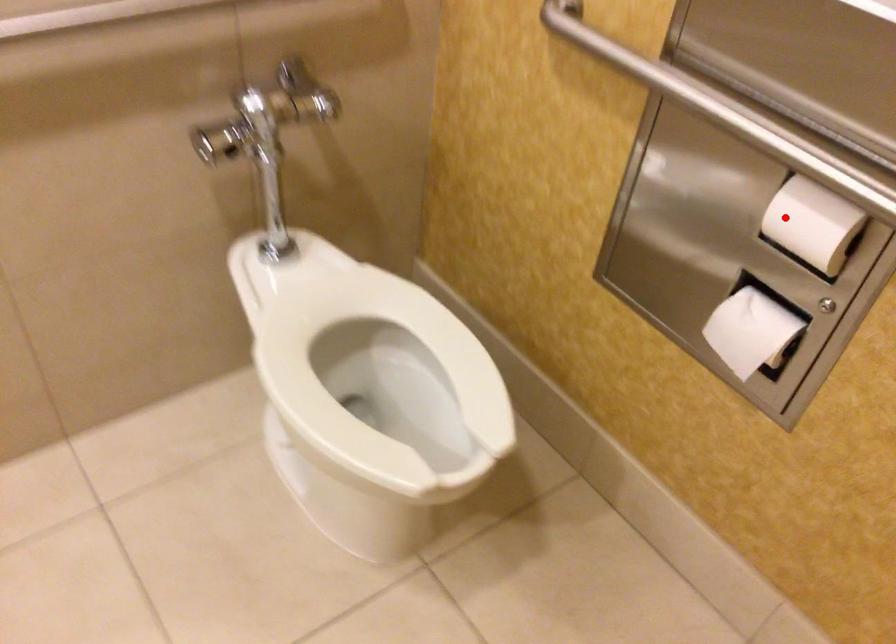
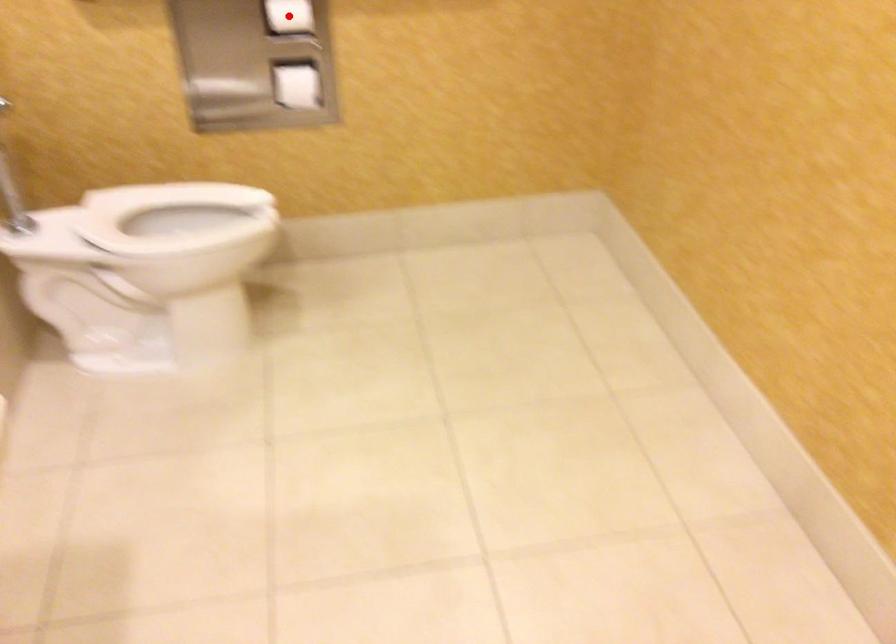
I am providing you with two images of the same scene from different viewpoints. A red point is marked on the first image and another point is marked on the second image. Do the highlighted points in image1 and image2 indicate the same real-world spot?

Yes